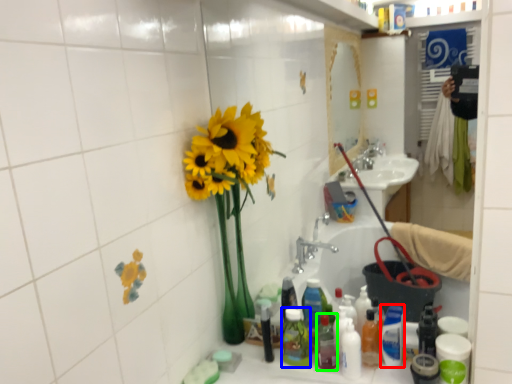
Question: Which object is the closest to the cleaning product (highlighted by a red box)? Choose among these: toiletry (highlighted by a blue box) or bottle (highlighted by a green box).

Choices:
 (A) toiletry
 (B) bottle

Answer: (B)